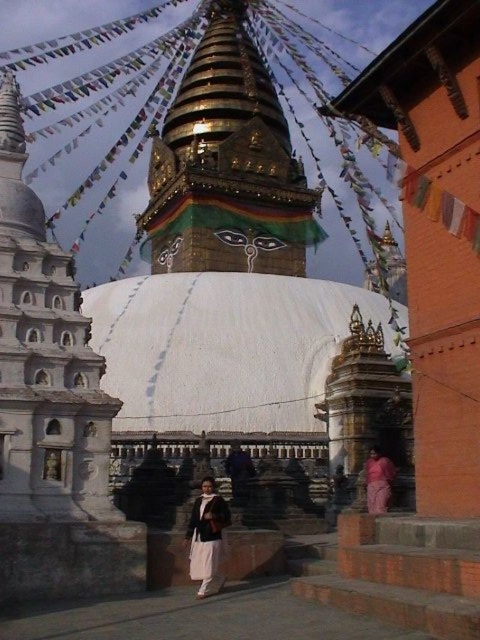
Does point (286, 148) come in front of point (382, 456)?

That is False.

Which of these two, gold/gilded stupa at center or pink fabric at lower right, stands shorter?

pink fabric at lower right

Which is behind, point (272, 253) or point (382, 500)?

The point (272, 253) is more distant.

Where is `gold/gilded stupa at center`? gold/gilded stupa at center is located at coordinates (227, 168).

Does white cotton robe at center have a smaller size compared to pink fabric at lower right?

Incorrect, white cotton robe at center is not smaller in size than pink fabric at lower right.

Can you confirm if white cotton robe at center is positioned to the right of pink fabric at lower right?

No, white cotton robe at center is not to the right of pink fabric at lower right.

Is point (205, 522) positioned before point (370, 512)?

Yes, it is.

At what (x,y) coordinates should I click in order to perform the action: click on white cotton robe at center. Please return your answer as a coordinate pair (x, y). The image size is (480, 640). Looking at the image, I should click on (205, 536).

Is gold/gilded stupa at center taller than white cotton robe at center?

Yes.

Who is shorter, gold/gilded stupa at center or white cotton robe at center?

Standing shorter between the two is white cotton robe at center.

Which is in front, point (230, 29) or point (204, 536)?

Point (204, 536) is in front.

I want to click on gold/gilded stupa at center, so click(x=227, y=168).